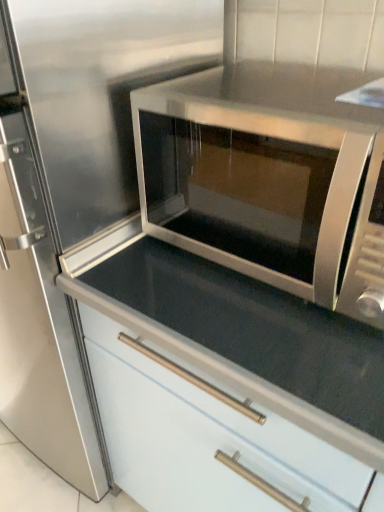
The width and height of the screenshot is (384, 512). In order to click on stainless steel microwave at center in this screenshot , I will do `click(264, 175)`.

The height and width of the screenshot is (512, 384). What do you see at coordinates (264, 175) in the screenshot? I see `stainless steel microwave at center` at bounding box center [264, 175].

Measure the distance between point (308,288) and camera.

Point (308,288) and camera are 26.97 inches apart from each other.

The image size is (384, 512). What do you see at coordinates (229, 387) in the screenshot?
I see `white glossy cabinet at center` at bounding box center [229, 387].

Locate an element on the screen. white glossy cabinet at center is located at coordinates (229, 387).

Measure the distance between point (142, 249) and camera.

34.33 inches.

Image resolution: width=384 pixels, height=512 pixels. What are the coordinates of `stainless steel microwave at center` in the screenshot? It's located at (264, 175).

Is stainless steel microwave at center at the left side of white glossy cabinet at center?

In fact, stainless steel microwave at center is to the right of white glossy cabinet at center.

Who is more distant, stainless steel microwave at center or white glossy cabinet at center?

white glossy cabinet at center is more distant.

Considering the points (296, 174) and (224, 453), which point is behind, point (296, 174) or point (224, 453)?

The point (224, 453) is more distant.

From the image's perspective, would you say stainless steel microwave at center is positioned over white glossy cabinet at center?

→ Indeed, from the image's perspective, stainless steel microwave at center is shown above white glossy cabinet at center.

From a real-world perspective, is stainless steel microwave at center positioned over white glossy cabinet at center based on gravity?

Correct, in the physical world, stainless steel microwave at center is higher than white glossy cabinet at center.

Which of these two, stainless steel microwave at center or white glossy cabinet at center, is wider?

Wider between the two is white glossy cabinet at center.

Which of these two, stainless steel microwave at center or white glossy cabinet at center, stands shorter?

stainless steel microwave at center.

Between stainless steel microwave at center and white glossy cabinet at center, which one has larger size?

white glossy cabinet at center.

Does stainless steel microwave at center contain white glossy cabinet at center?

Actually, white glossy cabinet at center is outside stainless steel microwave at center.

Does stainless steel microwave at center touch white glossy cabinet at center?

No, stainless steel microwave at center is not making contact with white glossy cabinet at center.

Does stainless steel microwave at center turn towards white glossy cabinet at center?

No, stainless steel microwave at center is not turned towards white glossy cabinet at center.

How different are the orientations of stainless steel microwave at center and white glossy cabinet at center in degrees?

0.1 degrees separate the facing orientations of stainless steel microwave at center and white glossy cabinet at center.

How far apart are stainless steel microwave at center and white glossy cabinet at center?

A distance of 8.00 inches exists between stainless steel microwave at center and white glossy cabinet at center.

This screenshot has width=384, height=512. In order to click on microwave oven that appears above the white glossy cabinet at center (from the image's perspective) in this screenshot , I will do `click(264, 175)`.

Looking at this image, which object is positioned more to the left, white glossy cabinet at center or stainless steel microwave at center?

From the viewer's perspective, white glossy cabinet at center appears more on the left side.

Is white glossy cabinet at center further to camera compared to stainless steel microwave at center?

Yes, white glossy cabinet at center is further from the camera.

Does point (108, 426) come behind point (325, 202)?

Yes, point (108, 426) is behind point (325, 202).

From the image's perspective, relative to stainless steel microwave at center, is white glossy cabinet at center above or below?

white glossy cabinet at center is situated lower than stainless steel microwave at center in the image.

From a real-world perspective, is white glossy cabinet at center above or below stainless steel microwave at center?

Clearly, from a real-world perspective, white glossy cabinet at center is below stainless steel microwave at center.

Which object is wider, white glossy cabinet at center or stainless steel microwave at center?

white glossy cabinet at center.

Is white glossy cabinet at center taller than stainless steel microwave at center?

Yes.

Based on the photo, does white glossy cabinet at center have a smaller size compared to stainless steel microwave at center?

Incorrect, white glossy cabinet at center is not smaller in size than stainless steel microwave at center.

Is white glossy cabinet at center inside or outside of stainless steel microwave at center?

white glossy cabinet at center is located beyond the bounds of stainless steel microwave at center.

Would you consider white glossy cabinet at center to be distant from stainless steel microwave at center?

Actually, white glossy cabinet at center and stainless steel microwave at center are a little close together.

Is white glossy cabinet at center oriented towards stainless steel microwave at center?

No, white glossy cabinet at center is not turned towards stainless steel microwave at center.

How many degrees apart are the facing directions of white glossy cabinet at center and stainless steel microwave at center?

There is a 0.1-degree angle between the facing directions of white glossy cabinet at center and stainless steel microwave at center.

Measure the distance from white glossy cabinet at center to stainless steel microwave at center.

white glossy cabinet at center and stainless steel microwave at center are 8.00 inches apart.

Locate an element on the screen. cabinetry that is below the stainless steel microwave at center (from the image's perspective) is located at coordinates (229, 387).

Image resolution: width=384 pixels, height=512 pixels. In order to click on microwave oven that appears above the white glossy cabinet at center (from the image's perspective) in this screenshot , I will do `click(264, 175)`.

Where is `cabinetry that is under the stainless steel microwave at center (from a real-world perspective)`? This screenshot has width=384, height=512. cabinetry that is under the stainless steel microwave at center (from a real-world perspective) is located at coordinates pos(229,387).